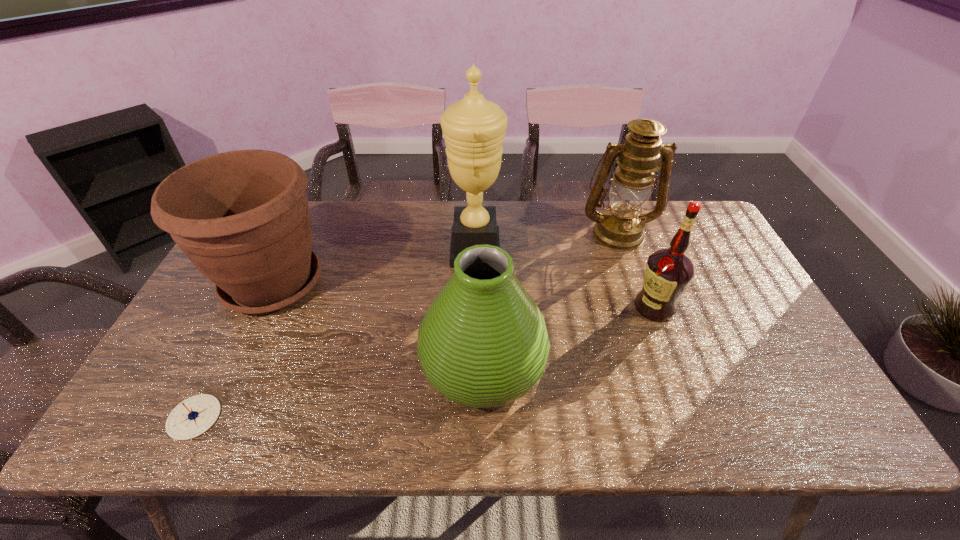
What are the coordinates of `free space between the oil lamp and the flowerpot` in the screenshot? It's located at (445, 258).

Where is `vacant point located between the alcohol and the oil lamp`? The width and height of the screenshot is (960, 540). vacant point located between the alcohol and the oil lamp is located at coordinates (636, 270).

Locate an element on the screen. This screenshot has width=960, height=540. vacant point located between the shortest object and the vase is located at coordinates coord(339,392).

This screenshot has height=540, width=960. I want to click on free spot between the shortest object and the tallest object, so click(x=335, y=334).

In order to click on unoccupied area between the trophy cup and the shortest object in this screenshot , I will do `click(335, 334)`.

Locate an element on the screen. Image resolution: width=960 pixels, height=540 pixels. object that is the fifth closest one to the alcohol is located at coordinates click(x=192, y=417).

Select which object appears as the closest to the oil lamp. Please provide its 2D coordinates. Your answer should be formatted as a tuple, i.e. [(x, y)], where the tuple contains the x and y coordinates of a point satisfying the conditions above.

[(668, 273)]

This screenshot has height=540, width=960. Find the location of `vacant region that satisfies the following two spatial constraints: 1. at the front of the vase with handles; 2. on the left side of the tallest object`. vacant region that satisfies the following two spatial constraints: 1. at the front of the vase with handles; 2. on the left side of the tallest object is located at coordinates click(x=474, y=366).

At what (x,y) coordinates should I click in order to perform the action: click on vacant space that satisfies the following two spatial constraints: 1. on the label of the alcohol; 2. on the front side of the vase. Please return your answer as a coordinate pair (x, y). Looking at the image, I should click on (677, 366).

Image resolution: width=960 pixels, height=540 pixels. Find the location of `vacant space that satisfies the following two spatial constraints: 1. on the back side of the compass; 2. on the right side of the oil lamp`. vacant space that satisfies the following two spatial constraints: 1. on the back side of the compass; 2. on the right side of the oil lamp is located at coordinates (287, 233).